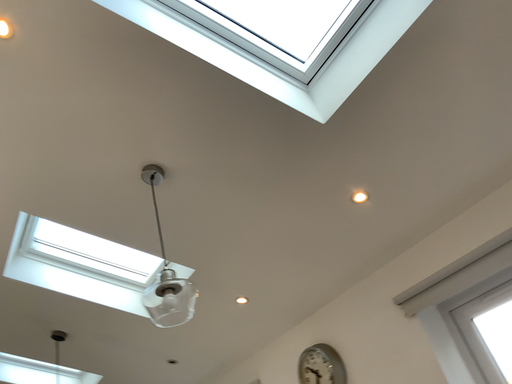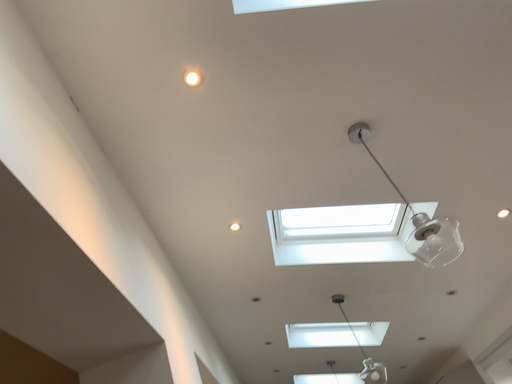
Question: Which way did the camera rotate in the video?

Choices:
 (A) rotated right
 (B) rotated left

Answer: (B)